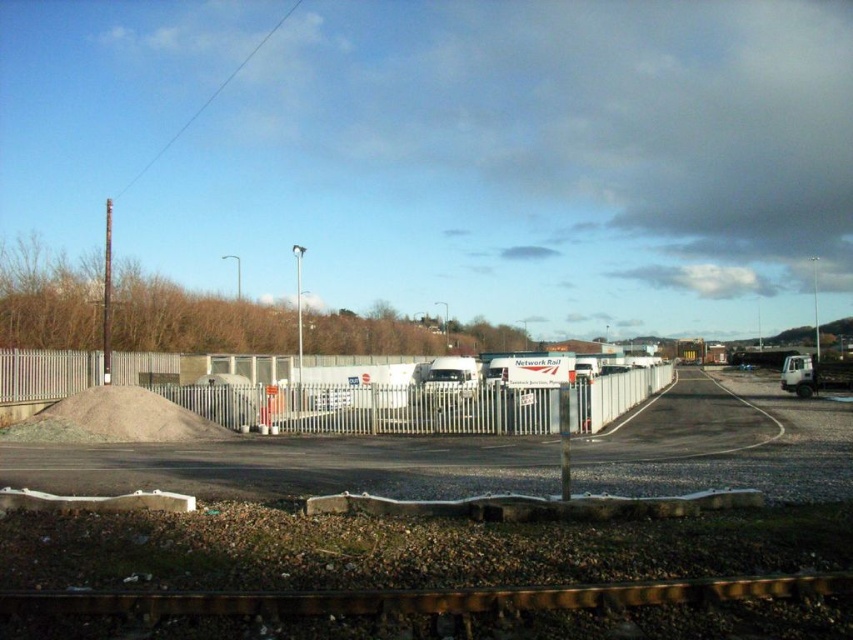
Question: Does white matte fence at center lie behind white metal fence at center?

Choices:
 (A) no
 (B) yes

Answer: (A)

Question: Which object is closer to the camera taking this photo?

Choices:
 (A) metallic gold train track at bottom
 (B) white metal fence at center

Answer: (A)

Question: Which object is closer to the camera taking this photo?

Choices:
 (A) white matte trailer truck at center
 (B) white metal fence at center
 (C) white matte fence at center
 (D) white matte trailer truck at right

Answer: (C)

Question: Does white matte fence at center have a lesser width compared to white metal fence at center?

Choices:
 (A) no
 (B) yes

Answer: (B)

Question: Can you confirm if white metal fence at center is positioned above white matte trailer truck at right?

Choices:
 (A) no
 (B) yes

Answer: (B)

Question: Which point is farther to the camera?

Choices:
 (A) white matte fence at center
 (B) metallic gold train track at bottom
 (C) gray gravel pile at lower left
 (D) white matte trailer truck at center

Answer: (D)